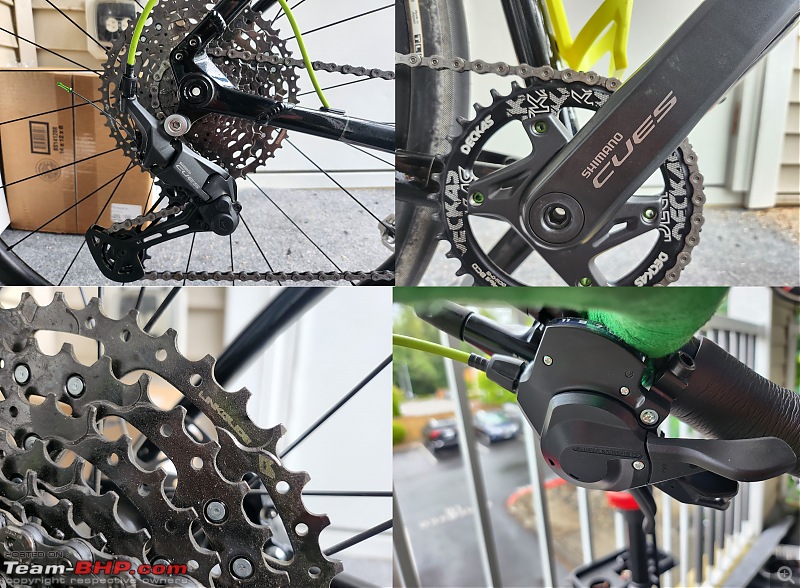
This screenshot has height=588, width=800. I want to click on door, so click(x=705, y=123), click(x=362, y=36).